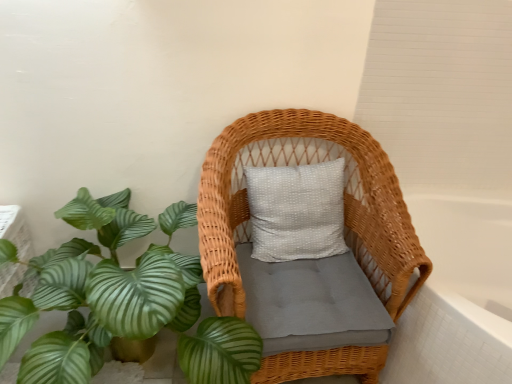
Question: Are woven wicker chair at center and green leafy plant at lower left beside each other?

Choices:
 (A) no
 (B) yes

Answer: (A)

Question: Considering the relative sizes of woven wicker chair at center and green leafy plant at lower left in the image provided, is woven wicker chair at center bigger than green leafy plant at lower left?

Choices:
 (A) no
 (B) yes

Answer: (A)

Question: From the image's perspective, is woven wicker chair at center below green leafy plant at lower left?

Choices:
 (A) yes
 (B) no

Answer: (B)

Question: Is woven wicker chair at center to the left of green leafy plant at lower left from the viewer's perspective?

Choices:
 (A) yes
 (B) no

Answer: (B)

Question: Is woven wicker chair at center thinner than green leafy plant at lower left?

Choices:
 (A) no
 (B) yes

Answer: (B)

Question: Are woven wicker chair at center and green leafy plant at lower left far apart?

Choices:
 (A) yes
 (B) no

Answer: (B)

Question: Is green leafy plant at lower left shorter than white glossy bathtub at right?

Choices:
 (A) yes
 (B) no

Answer: (B)

Question: Is green leafy plant at lower left thinner than white glossy bathtub at right?

Choices:
 (A) yes
 (B) no

Answer: (A)

Question: Considering the relative positions of green leafy plant at lower left and white glossy bathtub at right in the image provided, is green leafy plant at lower left to the left of white glossy bathtub at right from the viewer's perspective?

Choices:
 (A) no
 (B) yes

Answer: (B)

Question: Is green leafy plant at lower left not inside white glossy bathtub at right?

Choices:
 (A) yes
 (B) no

Answer: (A)

Question: Is green leafy plant at lower left smaller than white glossy bathtub at right?

Choices:
 (A) yes
 (B) no

Answer: (B)

Question: Is the position of green leafy plant at lower left less distant than that of white glossy bathtub at right?

Choices:
 (A) yes
 (B) no

Answer: (A)

Question: Considering the relative sizes of white glossy bathtub at right and woven wicker chair at center in the image provided, is white glossy bathtub at right smaller than woven wicker chair at center?

Choices:
 (A) yes
 (B) no

Answer: (B)